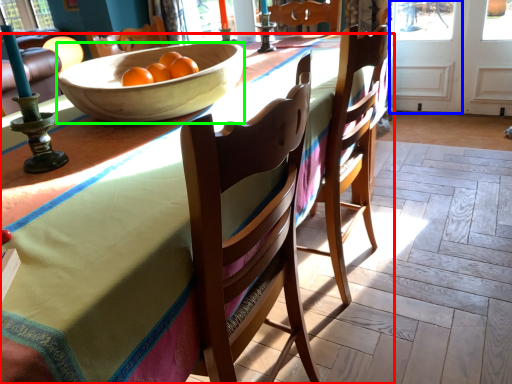
Question: Which object is the closest to the desk (highlighted by a red box)? Choose among these: screen door (highlighted by a blue box) or bowl (highlighted by a green box).

Choices:
 (A) screen door
 (B) bowl

Answer: (B)